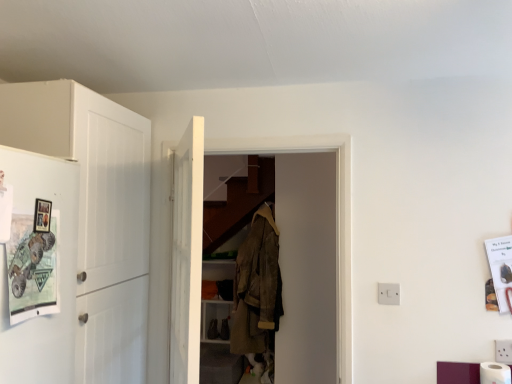
Question: Is white matte cabinet at left surrounded by white matte toilet paper at lower right?

Choices:
 (A) no
 (B) yes

Answer: (A)

Question: Does white matte toilet paper at lower right have a lesser height compared to white matte cabinet at left?

Choices:
 (A) no
 (B) yes

Answer: (B)

Question: From a real-world perspective, is white matte toilet paper at lower right physically above white matte cabinet at left?

Choices:
 (A) yes
 (B) no

Answer: (B)

Question: Is white matte toilet paper at lower right in front of white matte cabinet at left?

Choices:
 (A) yes
 (B) no

Answer: (B)

Question: Is white matte toilet paper at lower right at the right side of white matte cabinet at left?

Choices:
 (A) yes
 (B) no

Answer: (A)

Question: Does white matte toilet paper at lower right have a greater height compared to white matte cabinet at left?

Choices:
 (A) yes
 (B) no

Answer: (B)

Question: Is white wooden door at center at the right side of camouflage fabric jacket at center?

Choices:
 (A) yes
 (B) no

Answer: (B)

Question: Is white wooden door at center bigger than camouflage fabric jacket at center?

Choices:
 (A) no
 (B) yes

Answer: (B)

Question: Is white wooden door at center not near camouflage fabric jacket at center?

Choices:
 (A) no
 (B) yes

Answer: (B)

Question: Can you confirm if white wooden door at center is taller than camouflage fabric jacket at center?

Choices:
 (A) yes
 (B) no

Answer: (A)

Question: Is white wooden door at center shorter than camouflage fabric jacket at center?

Choices:
 (A) yes
 (B) no

Answer: (B)

Question: From the image's perspective, is white wooden door at center beneath camouflage fabric jacket at center?

Choices:
 (A) yes
 (B) no

Answer: (B)

Question: Is white wooden door at center outside white matte toilet paper at lower right?

Choices:
 (A) yes
 (B) no

Answer: (A)